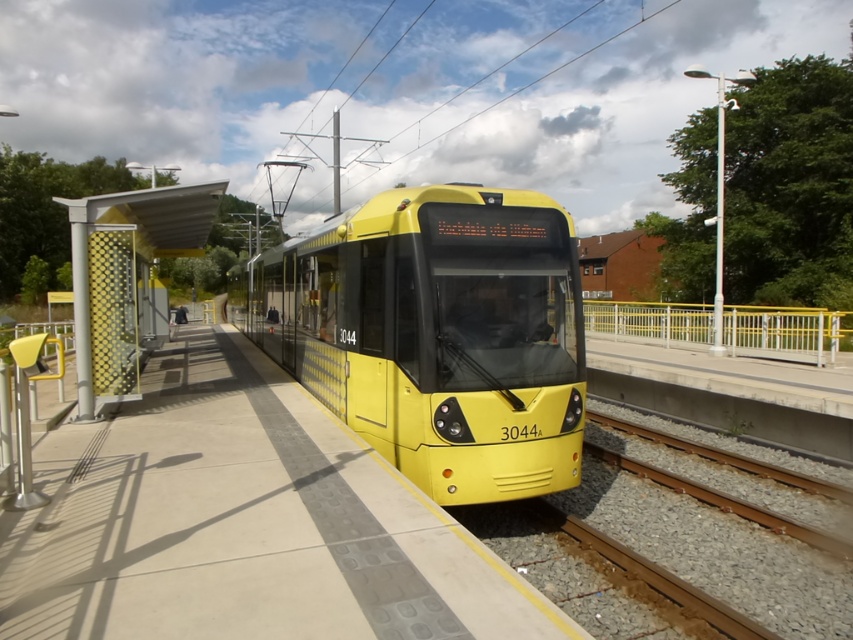
Which is behind, point (100, 436) or point (770, 333)?

Point (770, 333)

Which is in front, point (144, 572) or point (643, 308)?

Point (144, 572) is in front.

Locate an element on the screen. smooth concrete platform at center is located at coordinates (x=242, y=524).

Is yellow matte train at center wider than yellow mesh screen at left?

Yes, yellow matte train at center is wider than yellow mesh screen at left.

Is point (460, 182) positioned after point (152, 301)?

No, it is in front of (152, 301).

Is point (453, 348) in front of point (82, 273)?

Yes, point (453, 348) is in front of point (82, 273).

This screenshot has height=640, width=853. Identify the location of yellow matte train at center. (434, 333).

Does yellow matte train at center appear on the left side of yellow metal railing at right?

Correct, you'll find yellow matte train at center to the left of yellow metal railing at right.

Which of these two, yellow matte train at center or yellow metal railing at right, stands shorter?

yellow metal railing at right is shorter.

Between point (451, 250) and point (747, 349), which one is positioned in front?

Point (451, 250) is more forward.

At what (x,y) coordinates should I click in order to perform the action: click on yellow matte train at center. Please return your answer as a coordinate pair (x, y). Looking at the image, I should click on (434, 333).